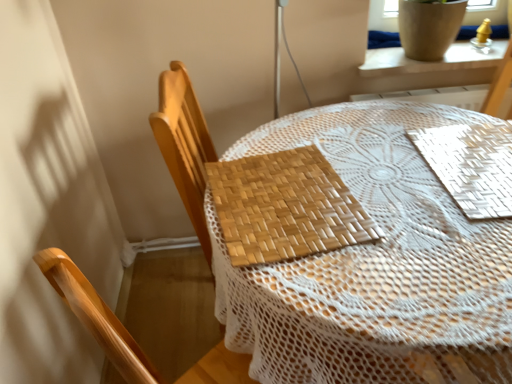
Locate an element on the screen. Image resolution: width=512 pixels, height=384 pixels. free point below white woven mat at upper right, arranged as the second mat when viewed from the left (from a real-world perspective) is located at coordinates (471, 153).